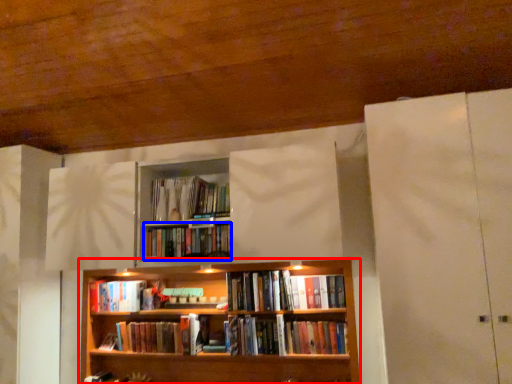
Question: Which object is further to the camera taking this photo, bookcase (highlighted by a red box) or book (highlighted by a blue box)?

Choices:
 (A) bookcase
 (B) book

Answer: (B)